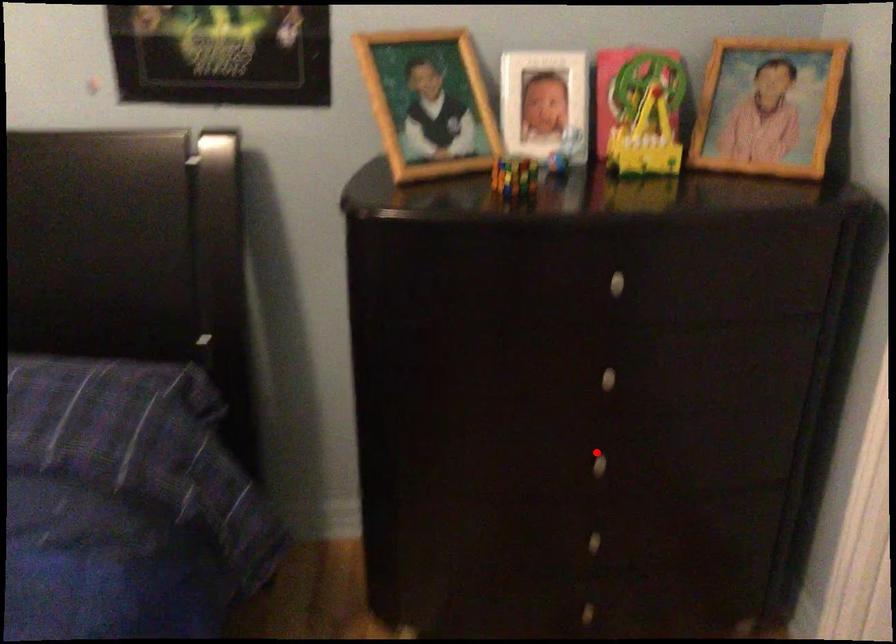
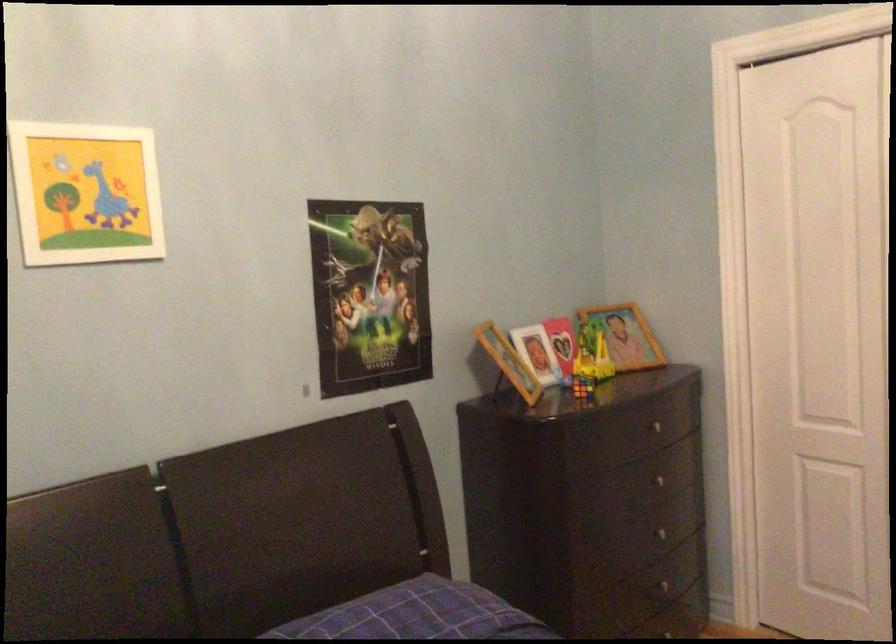
Question: A red point is marked in image1. In image2, is the corresponding 3D point closer to the camera or farther? Reply with the corresponding letter.

Choices:
 (A) The corresponding 3D point is closer.
 (B) The corresponding 3D point is farther.

Answer: (B)